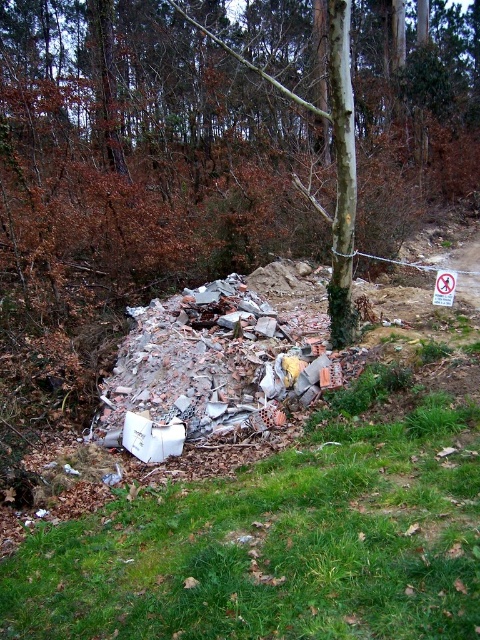
You are a gardener who wants to plant a new flower bed. You see the green bark tree at center and the green grass at lower center. Which object is positioned higher in the scene?

The green bark tree at center is above the green grass at lower center, so the green bark tree at center is positioned higher in the scene.